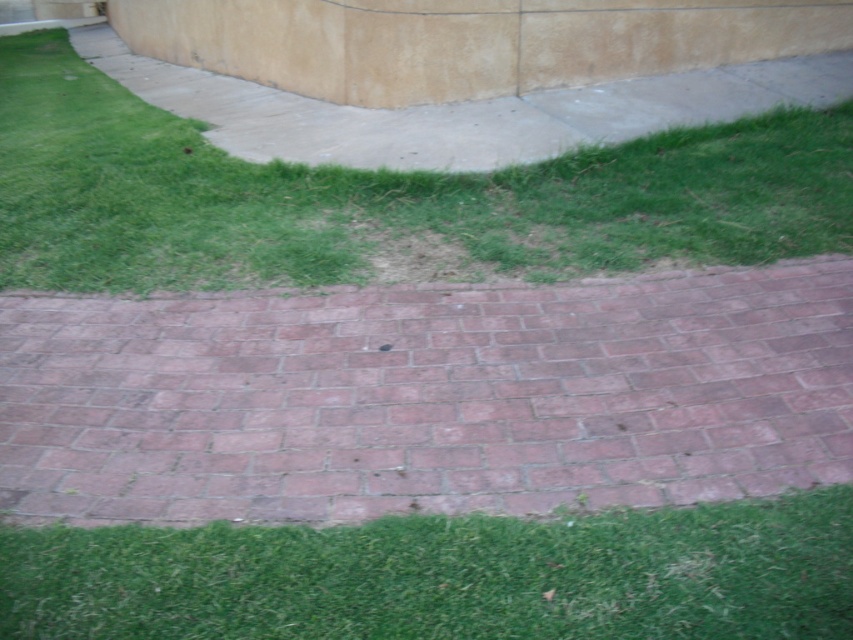
Based on the photo, does red brick at center appear on the left side of green grass at center?

Yes, red brick at center is to the left of green grass at center.

Which of these two, red brick at center or green grass at center, stands taller?

red brick at center is taller.

Does point (590, 413) come in front of point (381, 243)?

That is True.

At what (x,y) coordinates should I click in order to perform the action: click on red brick at center. Please return your answer as a coordinate pair (x, y). Looking at the image, I should click on (426, 397).

Is point (62, 234) positioned after point (577, 609)?

Yes, point (62, 234) is behind point (577, 609).

Locate an element on the screen. This screenshot has width=853, height=640. green grass at center is located at coordinates (381, 198).

Is point (103, 237) less distant than point (329, 573)?

No.

In order to click on green grass at center in this screenshot , I will do `click(381, 198)`.

Can you confirm if red brick at center is wider than green grass at lower center?

Yes.

Which is in front, point (708, 410) or point (248, 634)?

Point (248, 634) is in front.

This screenshot has width=853, height=640. What do you see at coordinates (426, 397) in the screenshot?
I see `red brick at center` at bounding box center [426, 397].

Where is `red brick at center`? Image resolution: width=853 pixels, height=640 pixels. red brick at center is located at coordinates (426, 397).